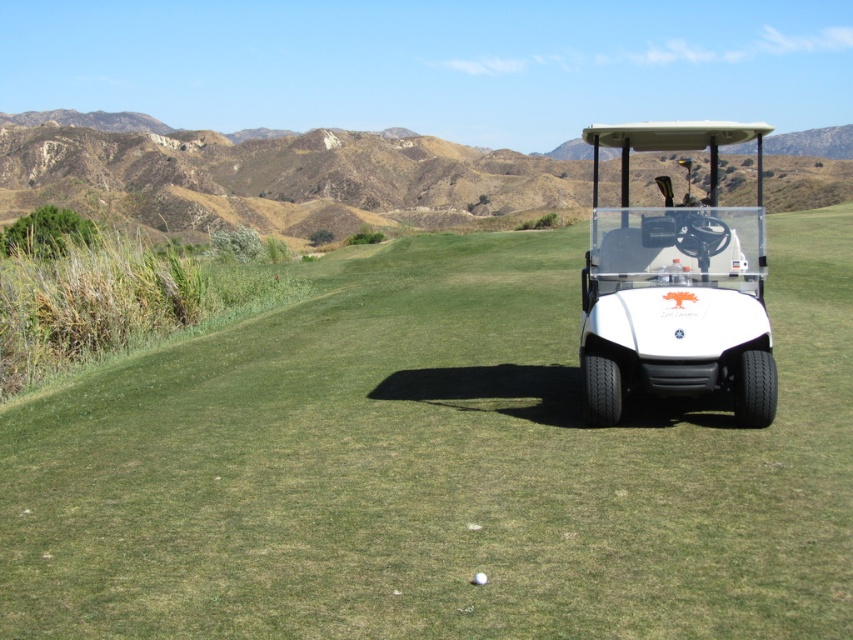
Question: Does white matte golf cart at center lie in front of white matte golf ball at center?

Choices:
 (A) no
 (B) yes

Answer: (A)

Question: Which of the following is the closest to the observer?

Choices:
 (A) (817, 518)
 (B) (584, 268)
 (C) (51, 129)
 (D) (480, 582)

Answer: (D)

Question: Among these points, which one is farthest from the camera?

Choices:
 (A) (189, 627)
 (B) (376, 220)
 (C) (743, 336)
 (D) (480, 576)

Answer: (B)

Question: Among these points, which one is farthest from the camera?

Choices:
 (A) (479, 577)
 (B) (271, 512)
 (C) (717, 376)
 (D) (836, 173)

Answer: (D)

Question: Does white matte golf cart at center have a greater width compared to white matte golf ball at center?

Choices:
 (A) yes
 (B) no

Answer: (A)

Question: Can you confirm if green grass at center is wider than white matte golf ball at center?

Choices:
 (A) yes
 (B) no

Answer: (A)